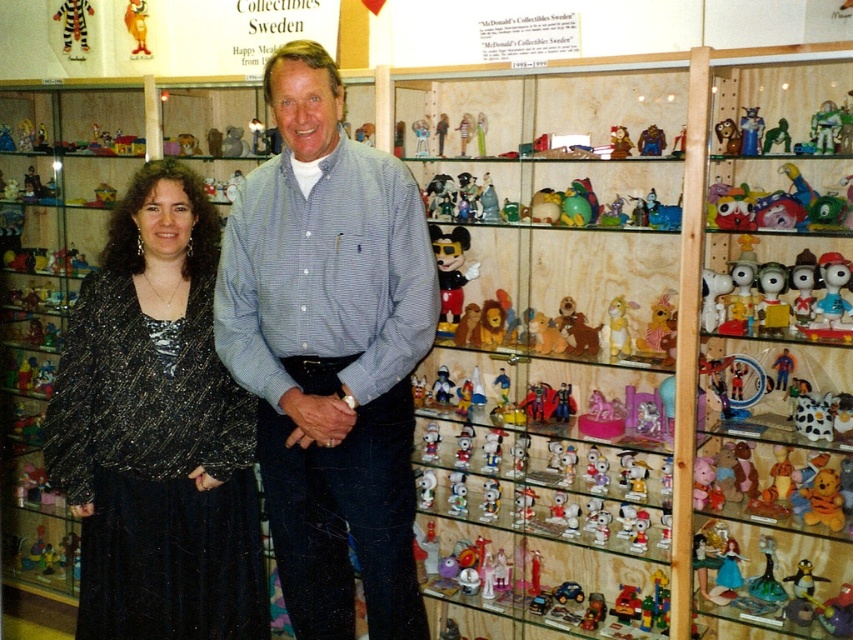
Can you confirm if light blue striped shirt at center is smaller than matte yellow plush rabbit at center?

No.

Can you confirm if light blue striped shirt at center is bigger than matte yellow plush rabbit at center?

Indeed, light blue striped shirt at center has a larger size compared to matte yellow plush rabbit at center.

Which is in front, point (346, 556) or point (619, 305)?

Point (346, 556) is in front.

The width and height of the screenshot is (853, 640). Find the location of `light blue striped shirt at center`. light blue striped shirt at center is located at coordinates (329, 352).

Locate an element on the screen. Image resolution: width=853 pixels, height=640 pixels. matte yellow plush rabbit at center is located at coordinates (618, 326).

Is matte yellow plush rabbit at center above translucent plastic minnie mouse at center?

Indeed, matte yellow plush rabbit at center is positioned over translucent plastic minnie mouse at center.

This screenshot has width=853, height=640. In order to click on matte yellow plush rabbit at center in this screenshot , I will do `click(618, 326)`.

Can you confirm if matte plastic toys at right is bigger than sparkly black dress at center?

Correct, matte plastic toys at right is larger in size than sparkly black dress at center.

Between matte plastic toys at right and sparkly black dress at center, which one appears on the left side from the viewer's perspective?

sparkly black dress at center

Locate an element on the screen. The width and height of the screenshot is (853, 640). matte plastic toys at right is located at coordinates (769, 349).